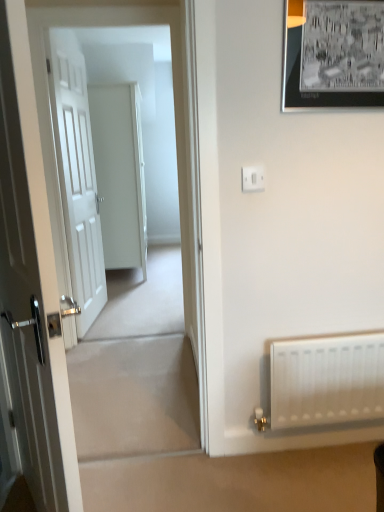
Where is `white matte radiator at lower right`? The height and width of the screenshot is (512, 384). white matte radiator at lower right is located at coordinates (327, 380).

Consider the image. What is the approximate height of white glossy door at center, which appears as the 3th door when viewed from the front?

6.21 feet.

In the scene shown: In order to face white matte door at left, which appears as the first door when viewed from the front, should I rotate leftwards or rightwards?

To align with it, rotate left about 22.132°.

Locate an element on the screen. Image resolution: width=384 pixels, height=512 pixels. white plastic switch at upper center is located at coordinates (253, 178).

What do you see at coordinates (77, 177) in the screenshot? This screenshot has height=512, width=384. I see `white wooden door at left, the 2th door when ordered from front to back` at bounding box center [77, 177].

Locate an element on the screen. The width and height of the screenshot is (384, 512). black matte picture frame at upper right is located at coordinates (334, 56).

Which is more to the left, black matte picture frame at upper right or white matte door at left, acting as the 3th door starting from the back?

Positioned to the left is white matte door at left, acting as the 3th door starting from the back.

Which of these two, black matte picture frame at upper right or white matte door at left, which appears as the first door when viewed from the front, stands shorter?

black matte picture frame at upper right is shorter.

Which object is thinner, black matte picture frame at upper right or white matte door at left, acting as the 3th door starting from the back?

black matte picture frame at upper right is thinner.

From a real-world perspective, count 3rd doors downward from the black matte picture frame at upper right and point to it. Please provide its 2D coordinates.

[(31, 283)]

Does white glossy door at center, marked as the first door in a back-to-front arrangement, contain white wooden door at left, the 2th door when ordered from front to back?

Definitely not — white wooden door at left, the 2th door when ordered from front to back, is not inside white glossy door at center, marked as the first door in a back-to-front arrangement.

Considering the relative positions of white glossy door at center, which appears as the 3th door when viewed from the front, and white wooden door at left, the 2th door when ordered from front to back, in the image provided, is white glossy door at center, which appears as the 3th door when viewed from the front, to the left of white wooden door at left, the 2th door when ordered from front to back, from the viewer's perspective?

No.

Considering the sizes of objects white glossy door at center, marked as the first door in a back-to-front arrangement, and white wooden door at left, arranged as the second door when viewed from the back, in the image provided, who is shorter, white glossy door at center, marked as the first door in a back-to-front arrangement, or white wooden door at left, arranged as the second door when viewed from the back,?

Standing shorter between the two is white glossy door at center, marked as the first door in a back-to-front arrangement.

Can you confirm if white glossy door at center, marked as the first door in a back-to-front arrangement, is bigger than white wooden door at left, arranged as the second door when viewed from the back?

Yes, white glossy door at center, marked as the first door in a back-to-front arrangement, is bigger than white wooden door at left, arranged as the second door when viewed from the back.

Considering their positions, is white wooden door at left, arranged as the second door when viewed from the back, located in front of or behind white matte door at left, which appears as the first door when viewed from the front?

white wooden door at left, arranged as the second door when viewed from the back, is positioned farther from the viewer than white matte door at left, which appears as the first door when viewed from the front.

Which object is wider, white wooden door at left, arranged as the second door when viewed from the back, or white matte door at left, acting as the 3th door starting from the back?

white matte door at left, acting as the 3th door starting from the back.

From a real-world perspective, is white wooden door at left, the 2th door when ordered from front to back, positioned above or below white matte door at left, which appears as the first door when viewed from the front?

From a real-world perspective, white wooden door at left, the 2th door when ordered from front to back, is physically above white matte door at left, which appears as the first door when viewed from the front.

From the image's perspective, does white wooden door at left, the 2th door when ordered from front to back, appear higher than white matte door at left, acting as the 3th door starting from the back?

Yes, from the image's perspective, white wooden door at left, the 2th door when ordered from front to back, is on top of white matte door at left, acting as the 3th door starting from the back.

Is white glossy door at center, marked as the first door in a back-to-front arrangement, facing away from white matte radiator at lower right?

No.

From the image's perspective, which object appears higher, white glossy door at center, which appears as the 3th door when viewed from the front, or white matte radiator at lower right?

white glossy door at center, which appears as the 3th door when viewed from the front, appears higher in the image.

From a real-world perspective, between white glossy door at center, which appears as the 3th door when viewed from the front, and white matte radiator at lower right, who is vertically higher?

In real-world perspective, white glossy door at center, which appears as the 3th door when viewed from the front, is above.

Is white glossy door at center, marked as the first door in a back-to-front arrangement, positioned behind white matte radiator at lower right?

That is True.

Considering the sizes of objects white wooden door at left, the 2th door when ordered from front to back, and white glossy door at center, which appears as the 3th door when viewed from the front, in the image provided, who is taller, white wooden door at left, the 2th door when ordered from front to back, or white glossy door at center, which appears as the 3th door when viewed from the front,?

With more height is white wooden door at left, the 2th door when ordered from front to back.

From the image's perspective, which is below, white wooden door at left, arranged as the second door when viewed from the back, or white glossy door at center, marked as the first door in a back-to-front arrangement?

From the image's view, white wooden door at left, arranged as the second door when viewed from the back, is below.

Which object is more forward, white wooden door at left, arranged as the second door when viewed from the back, or white glossy door at center, marked as the first door in a back-to-front arrangement?

white wooden door at left, arranged as the second door when viewed from the back.

Is white wooden door at left, the 2th door when ordered from front to back, positioned far away from white glossy door at center, which appears as the 3th door when viewed from the front?

No, there isn't a large distance between white wooden door at left, the 2th door when ordered from front to back, and white glossy door at center, which appears as the 3th door when viewed from the front.

From a real-world perspective, is black matte picture frame at upper right below white glossy door at center, which appears as the 3th door when viewed from the front?

Incorrect, from a real-world perspective, black matte picture frame at upper right is higher than white glossy door at center, which appears as the 3th door when viewed from the front.

Is black matte picture frame at upper right next to white glossy door at center, which appears as the 3th door when viewed from the front, and touching it?

No, black matte picture frame at upper right is not with white glossy door at center, which appears as the 3th door when viewed from the front.

Is black matte picture frame at upper right surrounding white glossy door at center, marked as the first door in a back-to-front arrangement?

No, white glossy door at center, marked as the first door in a back-to-front arrangement, is not surrounded by black matte picture frame at upper right.

Locate an element on the screen. This screenshot has width=384, height=512. picture frame that is below the white glossy door at center, which appears as the 3th door when viewed from the front (from the image's perspective) is located at coordinates (334, 56).

Considering the sizes of objects white plastic switch at upper center and white glossy door at center, marked as the first door in a back-to-front arrangement, in the image provided, who is smaller, white plastic switch at upper center or white glossy door at center, marked as the first door in a back-to-front arrangement,?

With smaller size is white plastic switch at upper center.

Could you tell me if white plastic switch at upper center is facing white glossy door at center, which appears as the 3th door when viewed from the front?

No, white plastic switch at upper center is not turned towards white glossy door at center, which appears as the 3th door when viewed from the front.

From a real-world perspective, who is located lower, white plastic switch at upper center or white glossy door at center, marked as the first door in a back-to-front arrangement?

white glossy door at center, marked as the first door in a back-to-front arrangement, is physically lower.

From the image's perspective, count 2nd doors downward from the black matte picture frame at upper right and point to it. Please provide its 2D coordinates.

[(31, 283)]

Which door is the 1st one when counting from the right side of the white wooden door at left, the 2th door when ordered from front to back? Please provide its 2D coordinates.

[(120, 174)]

When comparing their distances from white matte radiator at lower right, does white plastic switch at upper center or white wooden door at left, arranged as the second door when viewed from the back, seem closer?

white plastic switch at upper center.

Estimate the real-world distances between objects in this image. Which object is closer to white plastic switch at upper center, white glossy door at center, which appears as the 3th door when viewed from the front, or white matte door at left, which appears as the first door when viewed from the front?

The object closer to white plastic switch at upper center is white matte door at left, which appears as the first door when viewed from the front.

When comparing their distances from white plastic switch at upper center, does white glossy door at center, which appears as the 3th door when viewed from the front, or white matte radiator at lower right seem further?

white glossy door at center, which appears as the 3th door when viewed from the front, is positioned further to the anchor white plastic switch at upper center.

Based on their spatial positions, is white matte radiator at lower right or black matte picture frame at upper right further from white plastic switch at upper center?

white matte radiator at lower right.

From the image, which object appears to be farther from black matte picture frame at upper right, white wooden door at left, arranged as the second door when viewed from the back, or white matte radiator at lower right?

Among the two, white wooden door at left, arranged as the second door when viewed from the back, is located further to black matte picture frame at upper right.

Based on the photo, looking at the image, which one is located further to white glossy door at center, which appears as the 3th door when viewed from the front, black matte picture frame at upper right or white plastic switch at upper center?

Based on the image, black matte picture frame at upper right appears to be further to white glossy door at center, which appears as the 3th door when viewed from the front.

Estimate the real-world distances between objects in this image. Which object is further from white plastic switch at upper center, white matte radiator at lower right or white glossy door at center, which appears as the 3th door when viewed from the front?

white glossy door at center, which appears as the 3th door when viewed from the front, is further to white plastic switch at upper center.

Based on their spatial positions, is white wooden door at left, arranged as the second door when viewed from the back, or white plastic switch at upper center closer to white glossy door at center, which appears as the 3th door when viewed from the front?

The object closer to white glossy door at center, which appears as the 3th door when viewed from the front, is white wooden door at left, arranged as the second door when viewed from the back.

You are a GUI agent. You are given a task and a screenshot of the screen. Output one action in this format:
    pyautogui.click(x=<x>, y=<y>)
    Task: Click on the radiator between white plastic switch at upper center and white glossy door at center, marked as the first door in a back-to-front arrangement, from front to back
    
    Given the screenshot: What is the action you would take?
    pyautogui.click(x=327, y=380)

I want to click on door between white matte door at left, which appears as the first door when viewed from the front, and white glossy door at center, which appears as the 3th door when viewed from the front, along the z-axis, so click(77, 177).

At what (x,y) coordinates should I click in order to perform the action: click on picture frame between white matte door at left, which appears as the first door when viewed from the front, and white wooden door at left, arranged as the second door when viewed from the back, in the front-back direction. Please return your answer as a coordinate pair (x, y). The width and height of the screenshot is (384, 512). Looking at the image, I should click on (334, 56).

The height and width of the screenshot is (512, 384). I want to click on electric outlet between black matte picture frame at upper right and white glossy door at center, which appears as the 3th door when viewed from the front, in the front-back direction, so click(253, 178).